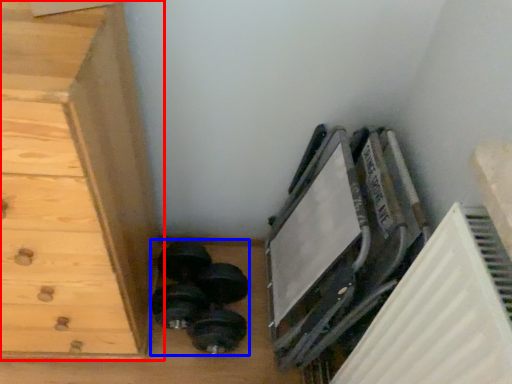
Question: Which point is closer to the camera, chest of drawers (highlighted by a red box) or dumbbell (highlighted by a blue box)?

Choices:
 (A) chest of drawers
 (B) dumbbell

Answer: (A)